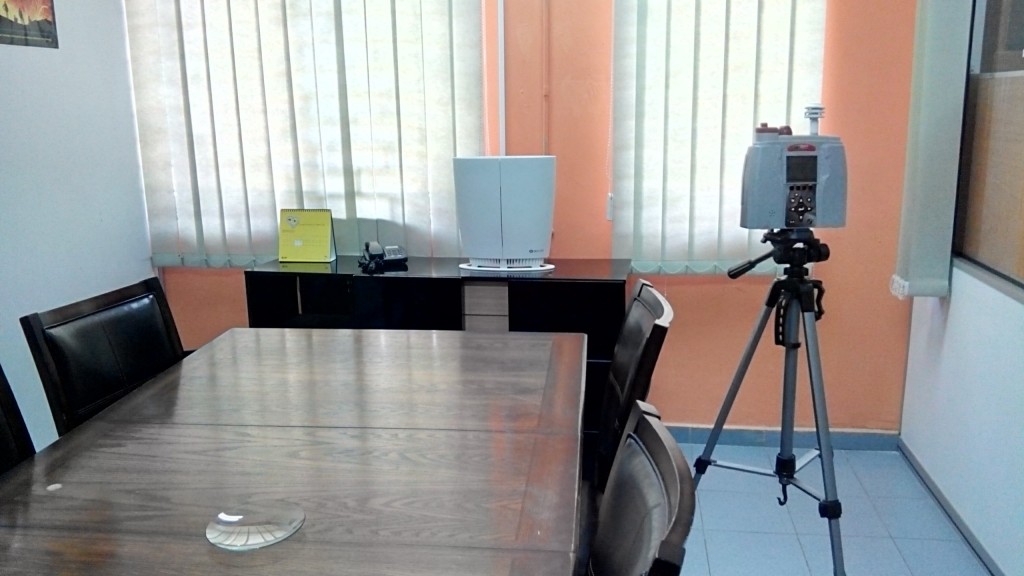
You are a GUI agent. You are given a task and a screenshot of the screen. Output one action in this format:
    pyautogui.click(x=<x>, y=<y>)
    Task: Click on the light blue wall
    
    Given the screenshot: What is the action you would take?
    pyautogui.click(x=23, y=162)